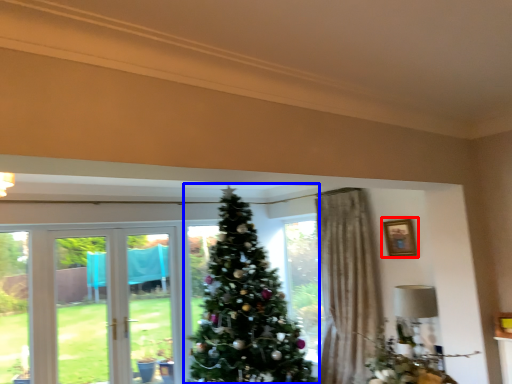
Question: Which object is closer to the camera taking this photo, picture frame (highlighted by a red box) or christmas tree (highlighted by a blue box)?

Choices:
 (A) picture frame
 (B) christmas tree

Answer: (B)